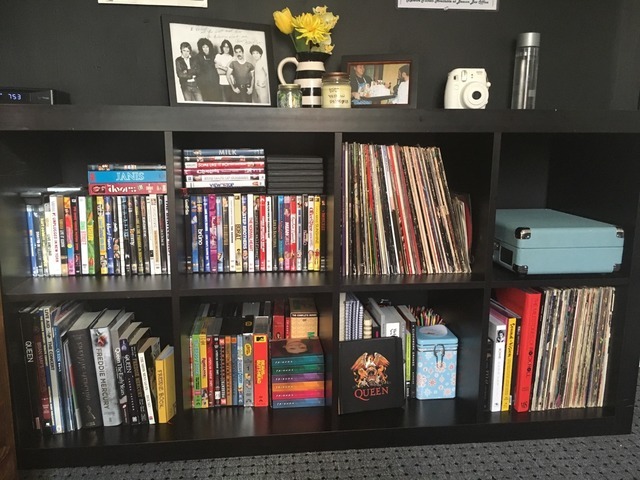
Find the location of `photo on shelf`. photo on shelf is located at coordinates (216, 25).